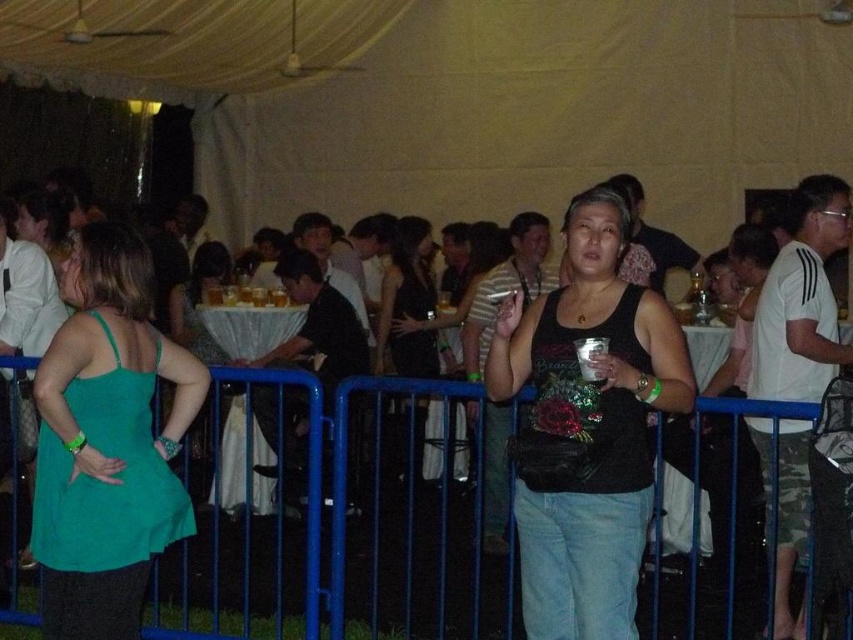
Question: Which point is farther to the camera?

Choices:
 (A) (509, 625)
 (B) (631, 595)
 (C) (419, 436)
 (D) (213, 323)

Answer: (D)

Question: Does green fabric dress at center lie behind black satin dress at center?

Choices:
 (A) yes
 (B) no

Answer: (B)

Question: Which object is positioned farthest from the black satin dress at center?

Choices:
 (A) blue metal fence at center
 (B) black matte tank top at center
 (C) green fabric dress at center

Answer: (B)

Question: Is the position of blue metal fence at center more distant than that of green fabric dress at center?

Choices:
 (A) yes
 (B) no

Answer: (B)

Question: From the image, what is the correct spatial relationship of blue metal fence at center in relation to green fabric dress at center?

Choices:
 (A) right
 (B) left

Answer: (A)

Question: Which point is closer to the camera?

Choices:
 (A) (418, 268)
 (B) (467, 611)

Answer: (B)